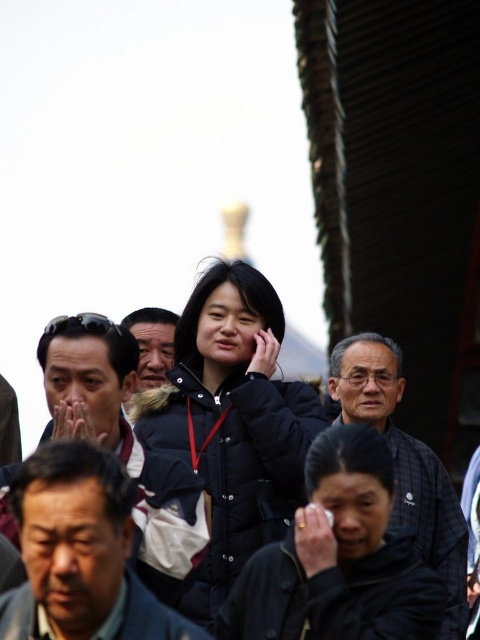
Is matte black jacket at center smaller than dark gray jacket at center?

Incorrect, matte black jacket at center is not smaller in size than dark gray jacket at center.

Can you confirm if matte black jacket at center is shorter than dark gray jacket at center?

No.

This screenshot has width=480, height=640. What do you see at coordinates (124, 444) in the screenshot?
I see `matte black jacket at center` at bounding box center [124, 444].

This screenshot has height=640, width=480. I want to click on matte black jacket at center, so click(124, 444).

Is point (436, 509) farther from camera compared to point (140, 384)?

That is False.

Is point (365, 356) closer to camera compared to point (158, 332)?

Yes, point (365, 356) is closer to viewer.

What do you see at coordinates (405, 464) in the screenshot? I see `plaid fabric shirt at center` at bounding box center [405, 464].

This screenshot has height=640, width=480. What are the coordinates of `plaid fabric shirt at center` in the screenshot? It's located at (405, 464).

Which of these two, matte black jacket at center or plaid fabric shirt at center, stands shorter?

With less height is matte black jacket at center.

Between matte black jacket at center and plaid fabric shirt at center, which one is positioned lower?

matte black jacket at center

Between point (196, 531) and point (379, 368), which one is positioned behind?

The point (379, 368) is behind.

Image resolution: width=480 pixels, height=640 pixels. What are the coordinates of `matte black jacket at center` in the screenshot? It's located at (124, 444).